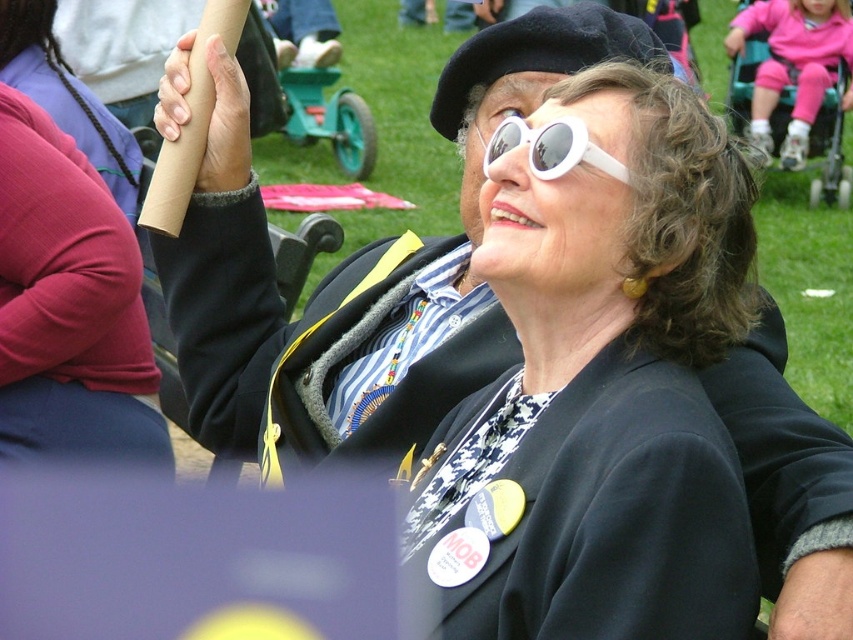
Question: Which point appears farthest from the camera in this image?

Choices:
 (A) (502, 148)
 (B) (579, 627)

Answer: (A)

Question: Considering the relative positions of white matte sunglasses at upper center and white plastic sunglasses at upper center in the image provided, where is white matte sunglasses at upper center located with respect to white plastic sunglasses at upper center?

Choices:
 (A) left
 (B) right

Answer: (B)

Question: Which object is closer to the camera taking this photo?

Choices:
 (A) white matte sunglasses at upper center
 (B) white plastic sunglasses at upper center

Answer: (A)

Question: Is white matte sunglasses at upper center to the right of white plastic sunglasses at upper center from the viewer's perspective?

Choices:
 (A) yes
 (B) no

Answer: (A)

Question: Is white matte sunglasses at upper center above white plastic sunglasses at upper center?

Choices:
 (A) yes
 (B) no

Answer: (B)